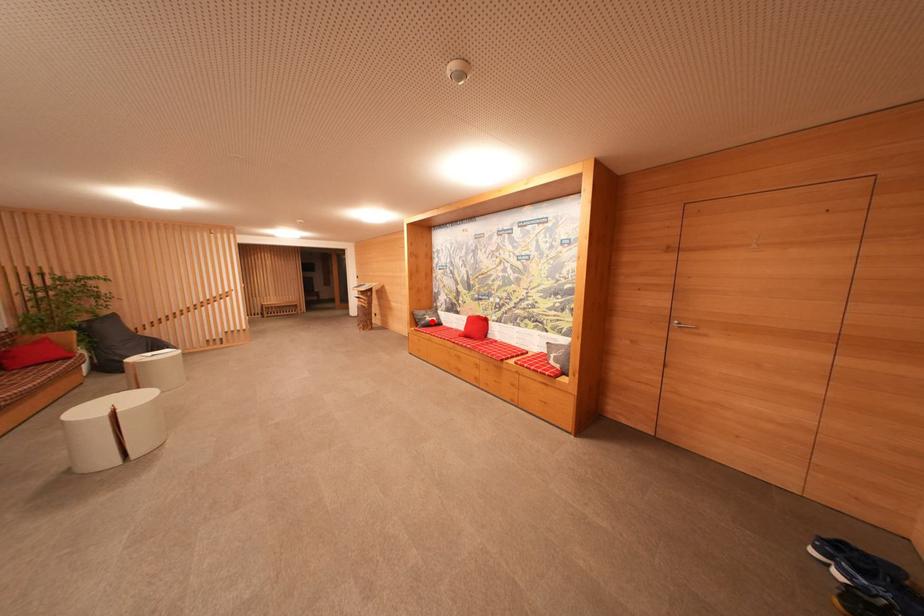
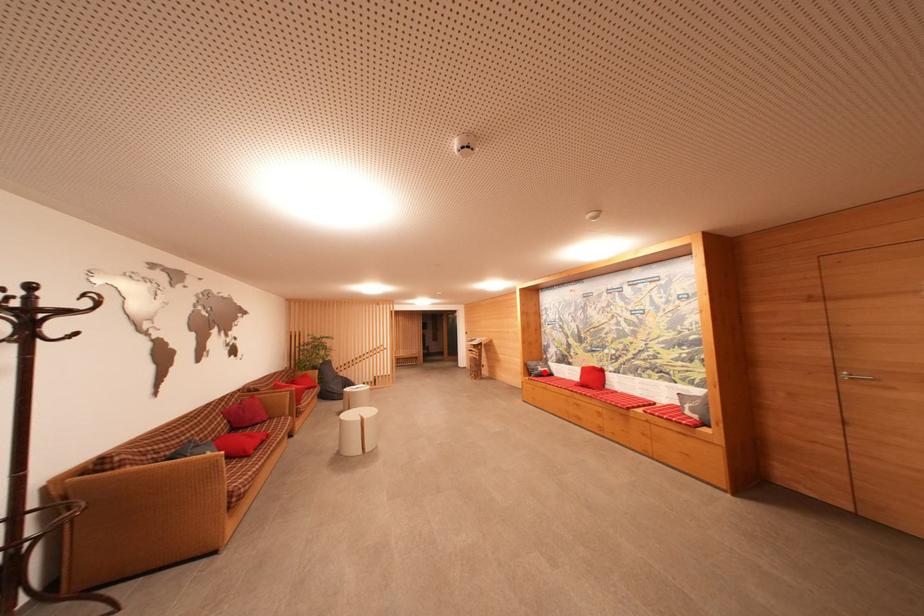
I am providing you with two images of the same scene from different viewpoints. A red point is marked on the first image and another point is marked on the second image. Are the points marked in image1 and image2 representing the same 3D position?

Yes